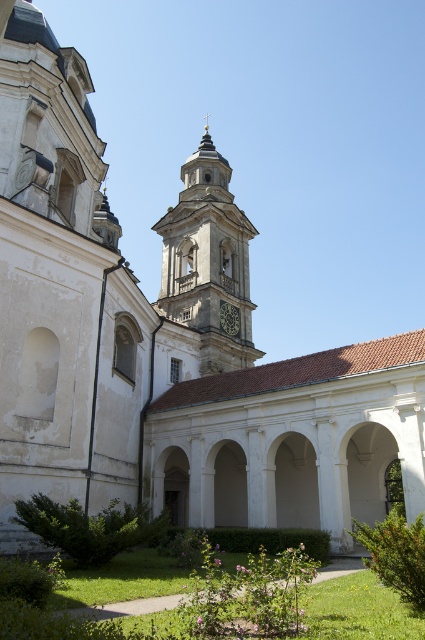
Does point (207, 340) lie behind point (229, 316)?

No, (207, 340) is in front of (229, 316).

Does smooth stone clock tower at center have a larger size compared to dark gray stone clock at center?

Correct, smooth stone clock tower at center is larger in size than dark gray stone clock at center.

Identify the location of smooth stone clock tower at center. The image size is (425, 640). (207, 260).